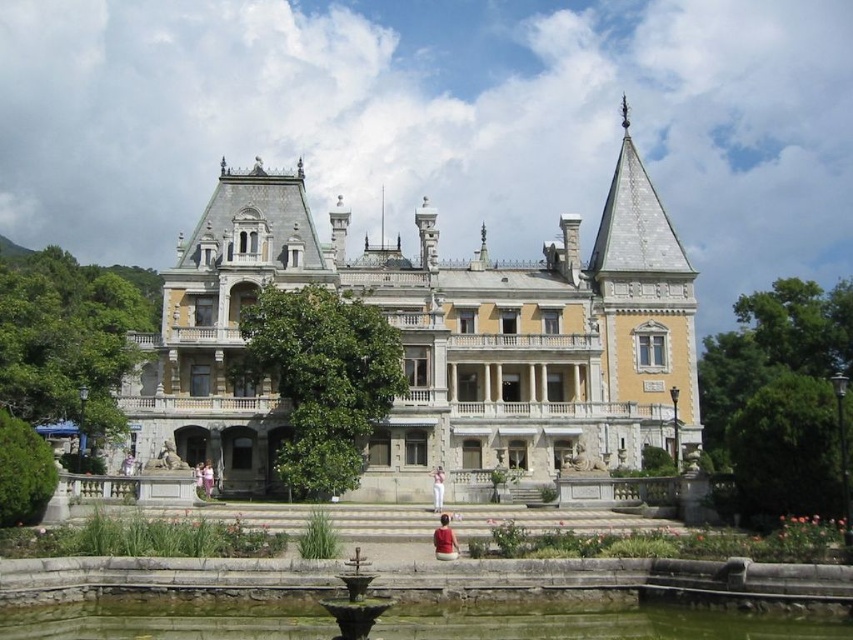
You are a photographer planning to take a portrait of two dresses displayed side by side in the garden of the Victorian building. The dresses are the white cotton dress at center and the pink fabric dress at center. Based on their sizes, which dress should be placed closer to the camera to ensure both appear equally sized in the photo?

The white cotton dress at center has a lesser width compared to the pink fabric dress at center. To make them appear equally sized in the photo, the white cotton dress at center should be placed closer to the camera since it is smaller in width.

You are attending a garden party and see two dresses hanging on a rack in the center of the garden. The white cotton dress at center and the pink fabric dress at center. Which dress is smaller in size?

The white cotton dress at center is smaller than the pink fabric dress at center.

You are planning to place a new decorative statue in the garden. The statue is 1.2 meters wide. Looking at the image, which object between the greenish stone water at lower center and the white cotton dress at center would allow enough space for the statue if placed next to it?

The greenish stone water at lower center has a greater width than the white cotton dress at center. Since the statue is 1.2 meters wide, placing it next to the greenish stone water at lower center would provide sufficient space due to its larger width compared to the white cotton dress at center.